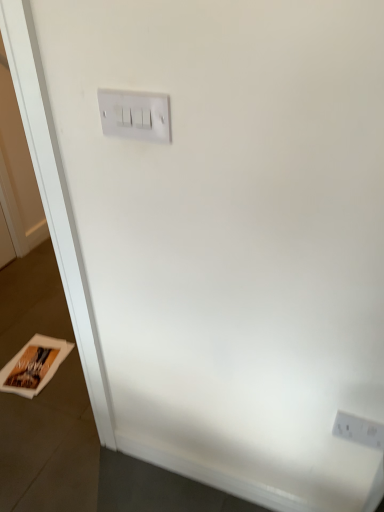
Question: Considering the positions of white glossy magazine at lower left and white plastic power plugs and sockets at lower right in the image, is white glossy magazine at lower left taller or shorter than white plastic power plugs and sockets at lower right?

Choices:
 (A) tall
 (B) short

Answer: (B)

Question: Is point (39, 378) positioned closer to the camera than point (377, 429)?

Choices:
 (A) closer
 (B) farther

Answer: (B)

Question: From a real-world perspective, is white glossy magazine at lower left positioned above or below white plastic power plugs and sockets at lower right?

Choices:
 (A) above
 (B) below

Answer: (B)

Question: Is point (365, 426) closer or farther from the camera than point (18, 392)?

Choices:
 (A) closer
 (B) farther

Answer: (A)

Question: From a real-world perspective, is white plastic power plugs and sockets at lower right physically located above or below white glossy magazine at lower left?

Choices:
 (A) below
 (B) above

Answer: (B)

Question: Is white plastic power plugs and sockets at lower right in front of or behind white glossy magazine at lower left in the image?

Choices:
 (A) behind
 (B) front

Answer: (B)

Question: From their relative heights in the image, would you say white plastic power plugs and sockets at lower right is taller or shorter than white glossy magazine at lower left?

Choices:
 (A) tall
 (B) short

Answer: (A)